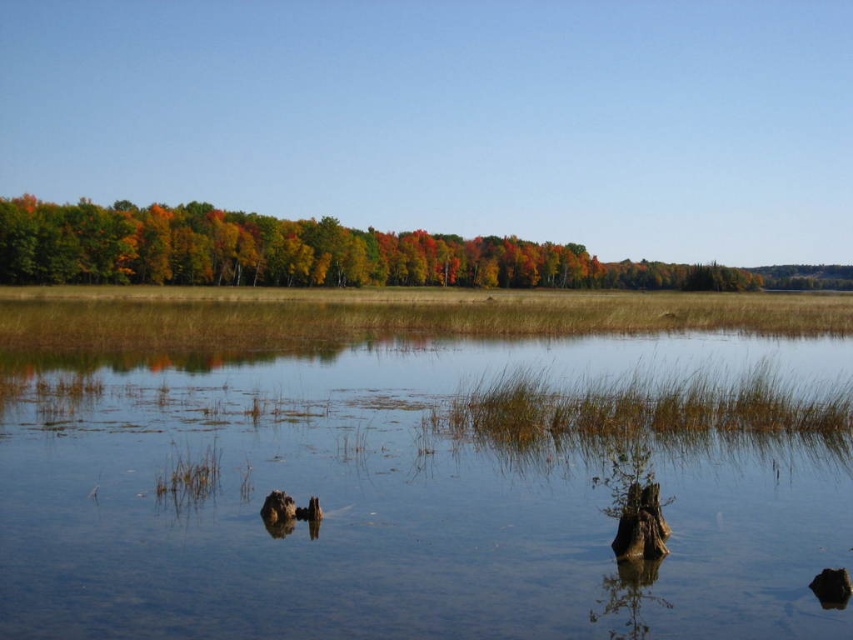
From the picture: You are standing at the edge of the water and see the clear water at center and the multicolored foliage at center. Which object is closer to your eye level?

The multicolored foliage at center is closer to your eye level because it is above the clear water at center.